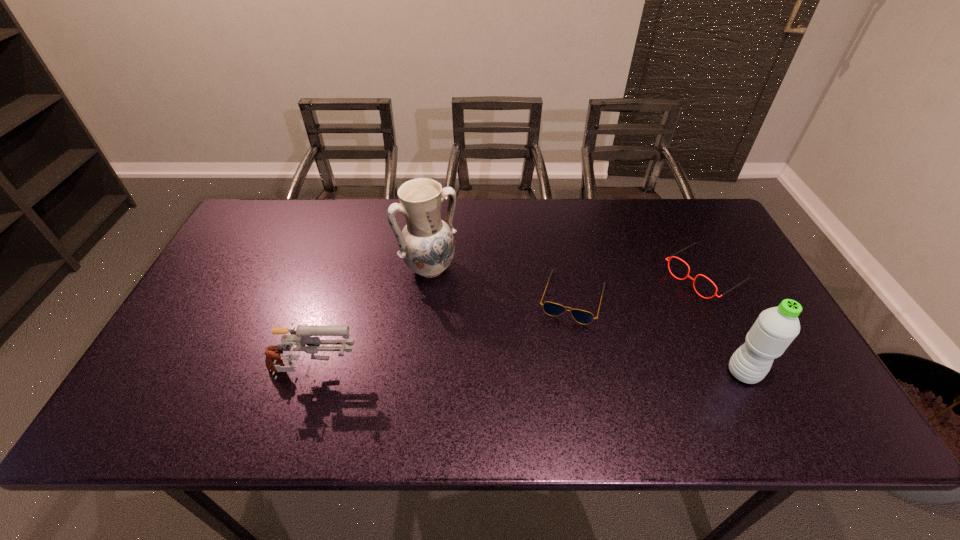
I want to click on free space located 0.340m on either side of the fourth object from right to left, so click(515, 370).

The height and width of the screenshot is (540, 960). In order to click on free space located 0.060m on either side of the fourth object from right to left in this screenshot , I will do `click(455, 297)`.

Find the location of a particular element. Image resolution: width=960 pixels, height=540 pixels. vacant space situated on the front-facing side of the second shortest object is located at coordinates (568, 357).

You are a GUI agent. You are given a task and a screenshot of the screen. Output one action in this format:
    pyautogui.click(x=<x>, y=<y>)
    Task: Click on the vacant space located on the front-facing side of the second shortest object
    
    Given the screenshot: What is the action you would take?
    pyautogui.click(x=568, y=357)

You are a GUI agent. You are given a task and a screenshot of the screen. Output one action in this format:
    pyautogui.click(x=<x>, y=<y>)
    Task: Click on the vacant space located 0.050m on the front-facing side of the second shortest object
    
    Given the screenshot: What is the action you would take?
    pyautogui.click(x=666, y=299)

The image size is (960, 540). Find the location of `vacant space located on the front-facing side of the shortest object`. vacant space located on the front-facing side of the shortest object is located at coordinates (557, 354).

I want to click on vacant space located on the front-facing side of the shortest object, so click(557, 354).

Image resolution: width=960 pixels, height=540 pixels. In order to click on vacant space located on the front-facing side of the shortest object in this screenshot , I will do `click(553, 367)`.

Find the location of a particular element. gun that is at the near edge is located at coordinates (300, 337).

This screenshot has width=960, height=540. In order to click on water bottle that is at the near edge in this screenshot , I will do `click(775, 328)`.